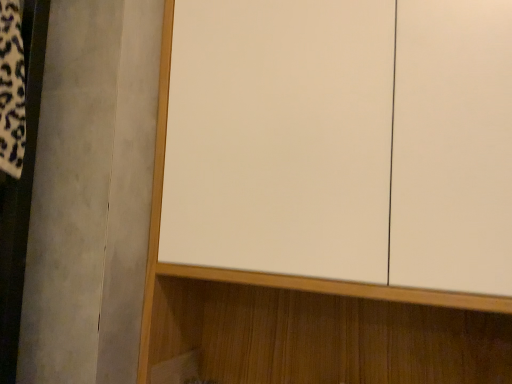
The width and height of the screenshot is (512, 384). Describe the element at coordinates (12, 90) in the screenshot. I see `black-and-white patterned blanket at left` at that location.

Image resolution: width=512 pixels, height=384 pixels. Identify the location of black-and-white patterned blanket at left. (12, 90).

You are a GUI agent. You are given a task and a screenshot of the screen. Output one action in this format:
    pyautogui.click(x=<x>, y=<y>)
    Task: Click on the black-and-white patterned blanket at left
    The height and width of the screenshot is (384, 512).
    Given the screenshot: What is the action you would take?
    pyautogui.click(x=12, y=90)